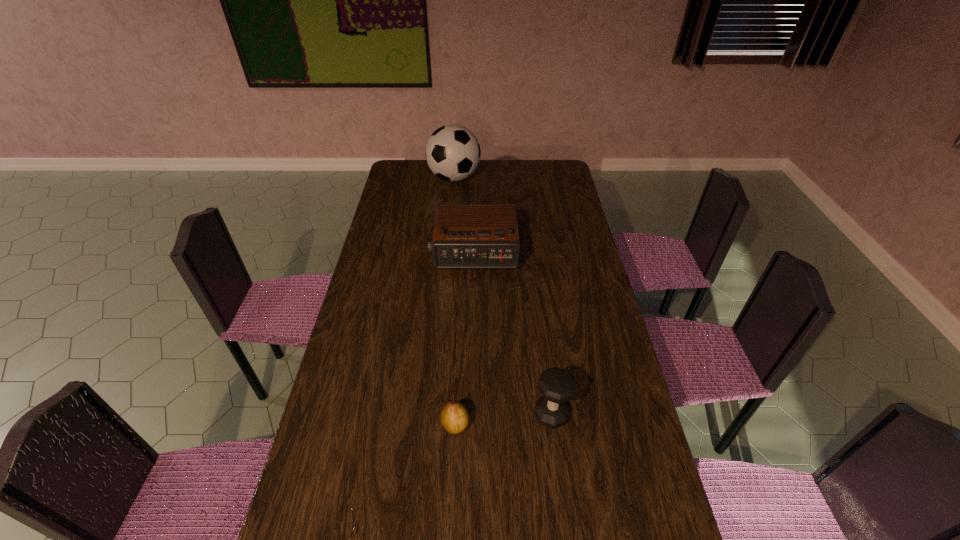
The image size is (960, 540). Find the location of `vacant point at the far edge`. vacant point at the far edge is located at coordinates (426, 176).

Find the location of a particular element. free spot at the left edge of the desktop is located at coordinates (393, 306).

At what (x,y) coordinates should I click in order to perform the action: click on vacant space at the right edge. Please return your answer as a coordinate pair (x, y). The width and height of the screenshot is (960, 540). Looking at the image, I should click on (552, 196).

Image resolution: width=960 pixels, height=540 pixels. Find the location of `vacant region at the far left corner`. vacant region at the far left corner is located at coordinates (393, 174).

At what (x,y) coordinates should I click in order to perform the action: click on vacant space at the far right corner of the desktop. Please return your answer as a coordinate pair (x, y). Looking at the image, I should click on (538, 177).

Identify the location of free point between the tallest object and the dumbbell. The height and width of the screenshot is (540, 960). point(503,296).

Locate an element on the screen. The width and height of the screenshot is (960, 540). unoccupied area between the rightmost object and the pear is located at coordinates (503, 420).

Where is `free space between the rightmost object and the pear`? This screenshot has height=540, width=960. free space between the rightmost object and the pear is located at coordinates (503, 420).

I want to click on blank region between the dumbbell and the tallest object, so (503, 296).

Locate an element on the screen. object identified as the closest to the second farthest object is located at coordinates (453, 153).